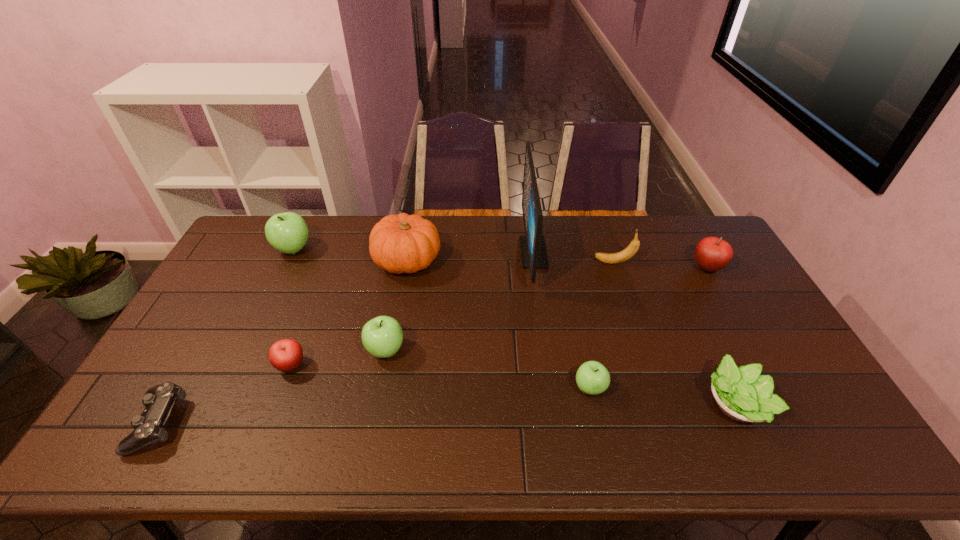
The width and height of the screenshot is (960, 540). Find the location of `free region located 0.110m on the left of the orange pumpkin`. free region located 0.110m on the left of the orange pumpkin is located at coordinates (342, 261).

Locate an element on the screen. vacant region located 0.130m on the front of the biggest green apple is located at coordinates (275, 288).

I want to click on free location located 0.060m at the start of the peel on the third object from right to left, so click(575, 262).

Where is `vacant space located at the start of the peel on the third object from right to left`? vacant space located at the start of the peel on the third object from right to left is located at coordinates (483, 262).

At what (x,y) coordinates should I click in order to perform the action: click on vacant area situated at the start of the peel on the third object from right to left. Please return your answer as a coordinate pair (x, y). Looking at the image, I should click on (549, 262).

Find the location of `free space located 0.170m on the front of the farther red apple`. free space located 0.170m on the front of the farther red apple is located at coordinates tap(735, 317).

Where is `vacant space located 0.090m on the back of the second biggest green apple`? The image size is (960, 540). vacant space located 0.090m on the back of the second biggest green apple is located at coordinates (393, 312).

You are a GUI agent. You are given a task and a screenshot of the screen. Output one action in this format:
    pyautogui.click(x=<x>, y=<y>)
    Task: Click on the vacant space located 0.310m on the right of the smaller red apple
    Image resolution: width=960 pixels, height=540 pixels.
    Given the screenshot: What is the action you would take?
    pyautogui.click(x=420, y=365)

Image resolution: width=960 pixels, height=540 pixels. What are the coordinates of `vacant area situated on the left of the second apple from right to left` in the screenshot? It's located at (421, 388).

Identify the location of vacant space located 0.120m on the back of the lettuce. (704, 338).